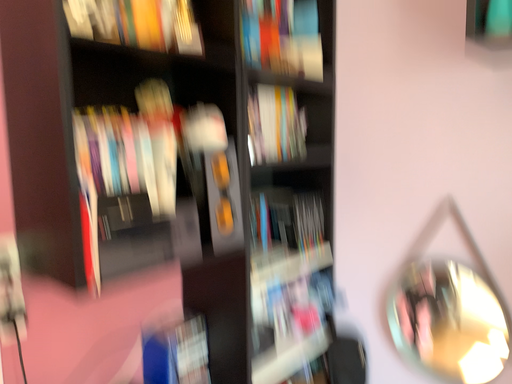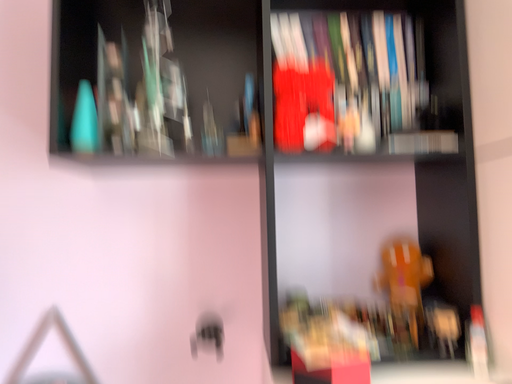
Question: Which way did the camera rotate in the video?

Choices:
 (A) rotated upward
 (B) rotated downward

Answer: (A)